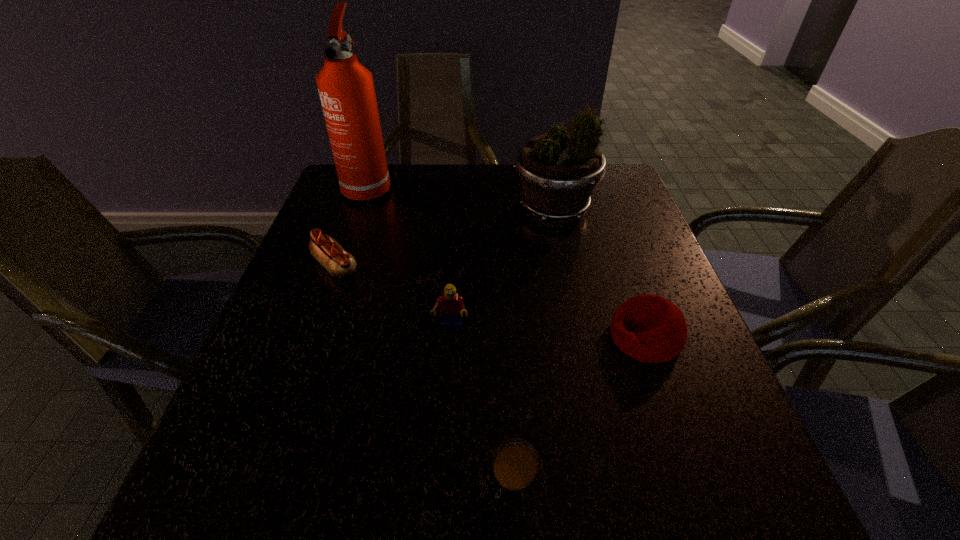
Locate an element on the screen. vacant area at the near right corner is located at coordinates (679, 477).

Locate an element on the screen. The width and height of the screenshot is (960, 540). free point between the Lego and the cappuccino is located at coordinates (482, 402).

Identify the location of vacant area between the fifth shortest object and the sausage. This screenshot has width=960, height=540. (444, 239).

Locate an element on the screen. free area in between the nearest object and the fire extinguisher is located at coordinates (441, 333).

Find the location of a particular element. vacant area that lies between the sausage and the fifth shortest object is located at coordinates (444, 239).

Where is `unoccupied area between the cappuccino and the fire extinguisher`? The height and width of the screenshot is (540, 960). unoccupied area between the cappuccino and the fire extinguisher is located at coordinates click(441, 333).

The image size is (960, 540). Identify the location of vacant area between the fifth shortest object and the cappuccino. (534, 345).

Locate an element on the screen. This screenshot has width=960, height=540. vacant space in between the beanbag and the tallest object is located at coordinates (507, 261).

Find the location of a particular element. unoccupied position between the cappuccino and the third farthest object is located at coordinates (424, 373).

The width and height of the screenshot is (960, 540). I want to click on free area in between the third shortest object and the flowerpot, so click(600, 274).